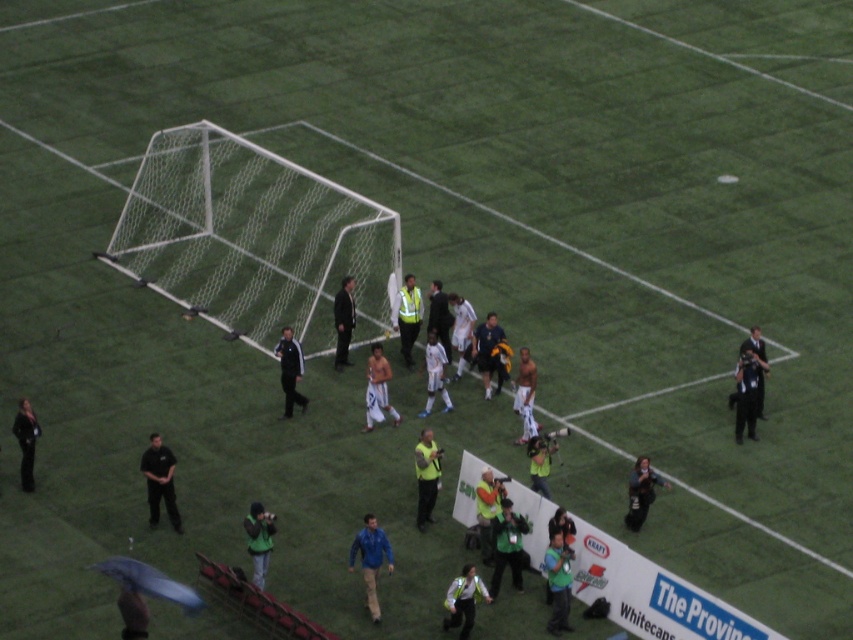
Does reflective green vest at center appear on the right side of white uniform at center?

Correct, you'll find reflective green vest at center to the right of white uniform at center.

Is reflective green vest at center positioned before white uniform at center?

That is True.

Between point (529, 470) and point (439, 310), which one is positioned behind?

Positioned behind is point (439, 310).

You are a GUI agent. You are given a task and a screenshot of the screen. Output one action in this format:
    pyautogui.click(x=<x>, y=<y>)
    Task: Click on the reflective green vest at center
    Image resolution: width=853 pixels, height=640 pixels.
    Given the screenshot: What is the action you would take?
    (540, 461)

Is green matte jacket at lower center wider than reflective yellow vest at center?

No.

Describe the element at coordinates (259, 540) in the screenshot. I see `green matte jacket at lower center` at that location.

Who is more forward, (254, 525) or (415, 300)?

Positioned in front is point (254, 525).

Locate an element on the screen. The image size is (853, 640). green matte jacket at lower center is located at coordinates (259, 540).

Can you confirm if reflective silver vest at center is positioned to the right of yellow reflective vest at center?

No, reflective silver vest at center is not to the right of yellow reflective vest at center.

The height and width of the screenshot is (640, 853). What do you see at coordinates (463, 600) in the screenshot?
I see `reflective silver vest at center` at bounding box center [463, 600].

Find the location of `reflective silver vest at center`. reflective silver vest at center is located at coordinates (463, 600).